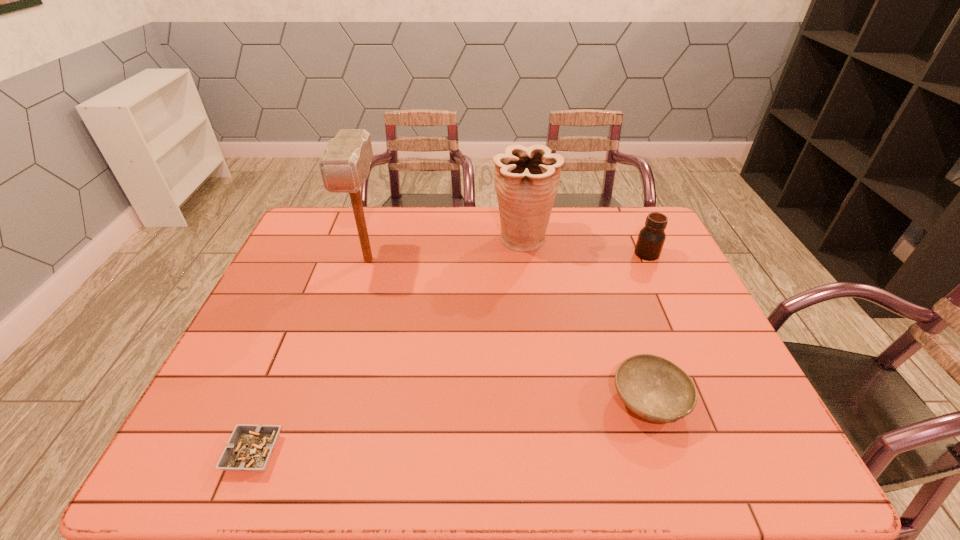
Find the location of a particular element. The image size is (960, 540). vacant region at the far left corner of the desktop is located at coordinates (293, 238).

Identify the location of vacant space at the near left corner of the desktop. The width and height of the screenshot is (960, 540). (180, 476).

This screenshot has height=540, width=960. I want to click on vacant space at the far right corner of the desktop, so click(619, 221).

Image resolution: width=960 pixels, height=540 pixels. In order to click on vacant space at the near right corner in this screenshot , I will do `click(740, 444)`.

Find the location of a particular element. free space between the second shortest object and the rightmost object is located at coordinates (648, 327).

In order to click on empty space that is in between the mallet and the third tallest object in this screenshot , I will do `click(508, 256)`.

Locate an element on the screen. Image resolution: width=960 pixels, height=540 pixels. free spot between the jar and the fourth object from right to left is located at coordinates (508, 256).

Where is `empty space between the third tallest object and the tallest object`? This screenshot has width=960, height=540. empty space between the third tallest object and the tallest object is located at coordinates (508, 256).

The height and width of the screenshot is (540, 960). Identify the location of unoccupied area between the third tallest object and the second object from left to right. click(x=508, y=256).

This screenshot has width=960, height=540. What are the coordinates of `vacant region between the second object from right to left and the ashtray` in the screenshot? It's located at (451, 427).